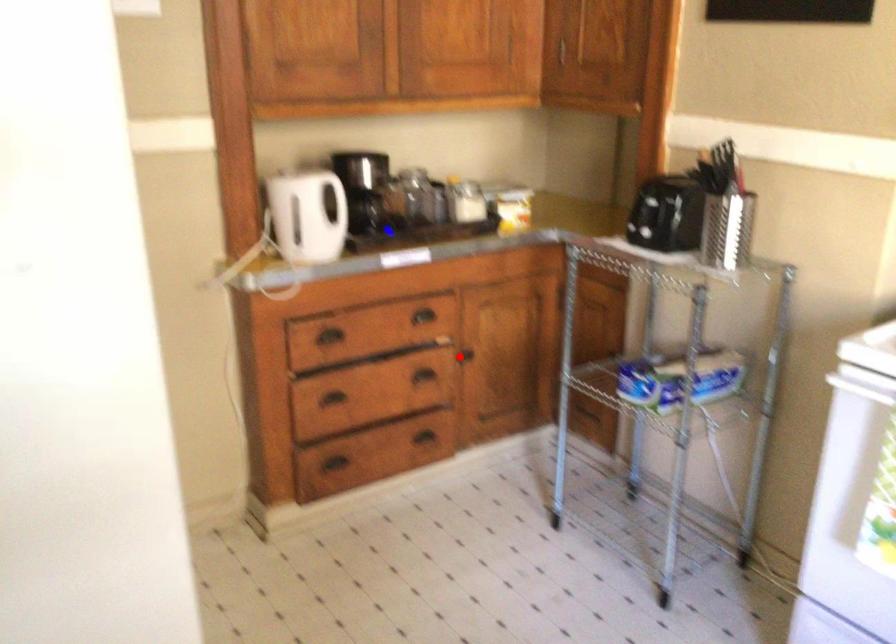
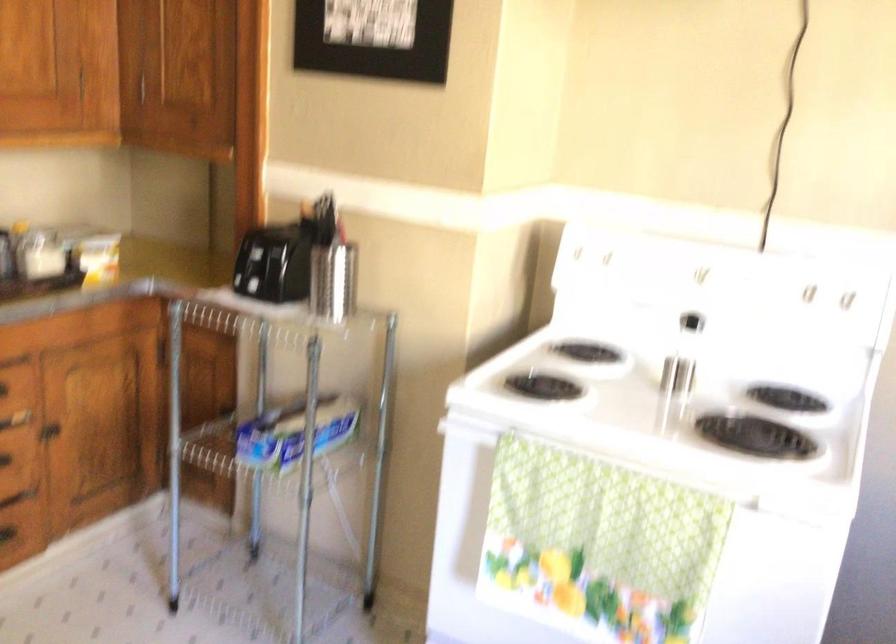
Question: I am providing you with two images of the same scene from different viewpoints. A red point is shown in image1. For the corresponding object point in image2, is it positioned nearer or farther from the camera?

Choices:
 (A) Nearer
 (B) Farther

Answer: (A)